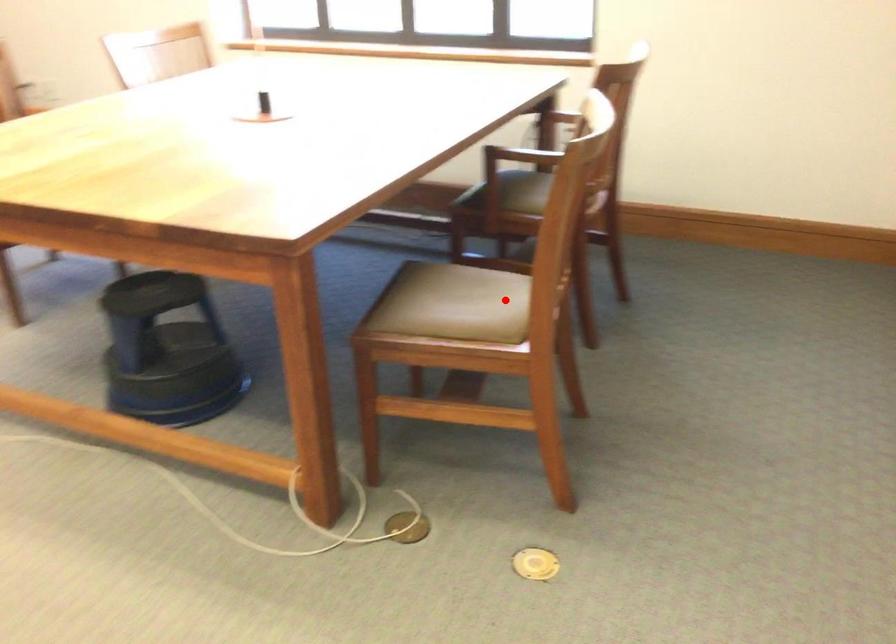
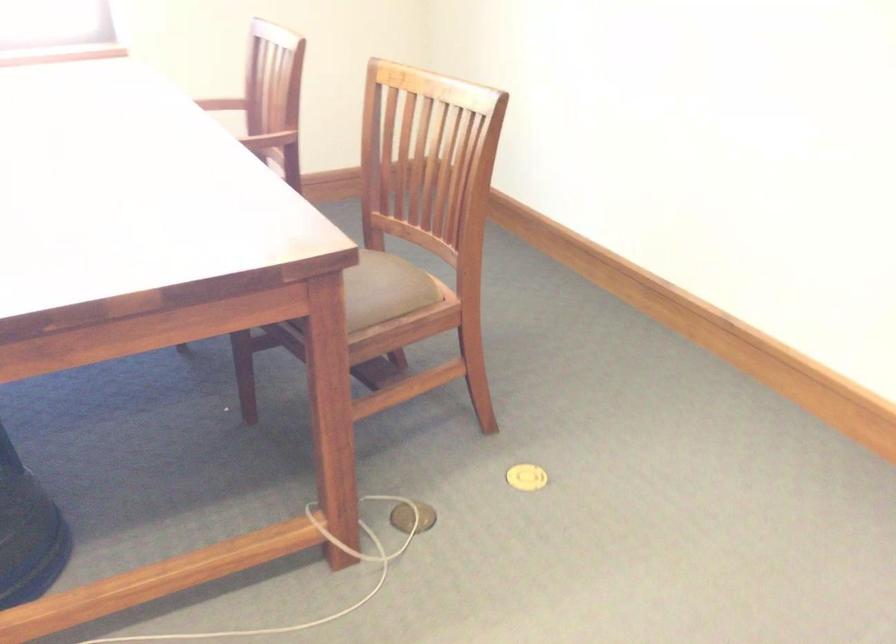
Where in the second image is the point corresponding to the highlighted location from the first image?

(382, 274)